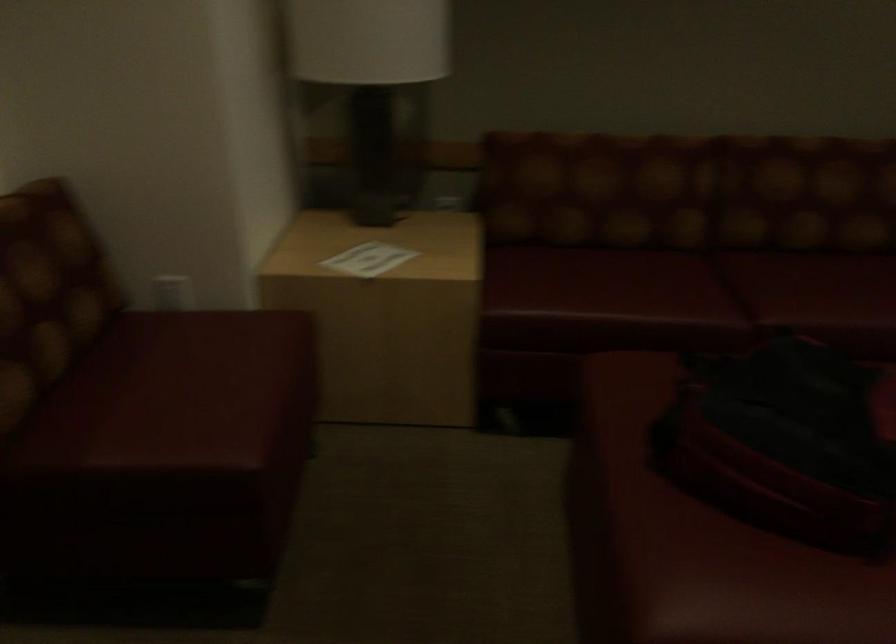
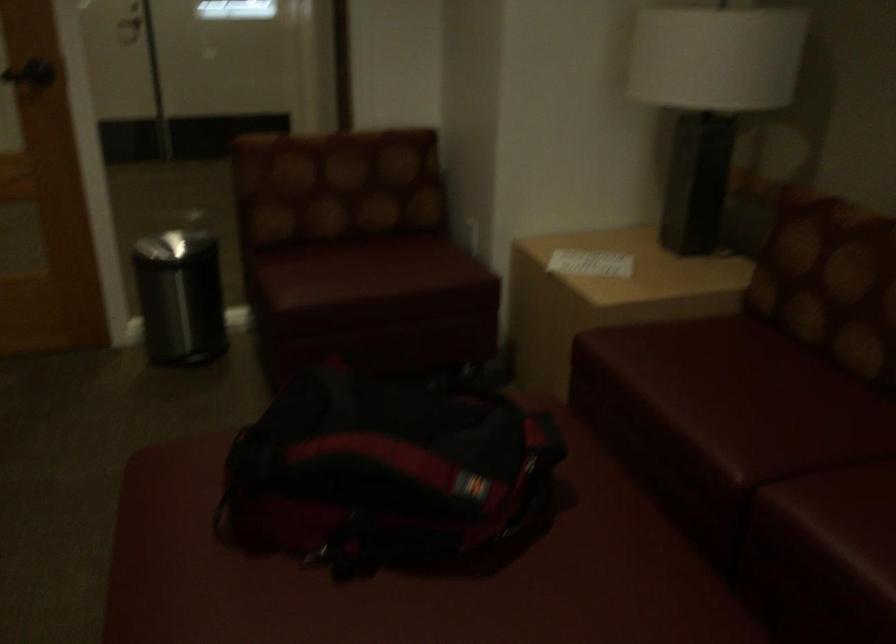
In the second image, find the point that corresponds to the point at 212,383 in the first image.

(367, 270)